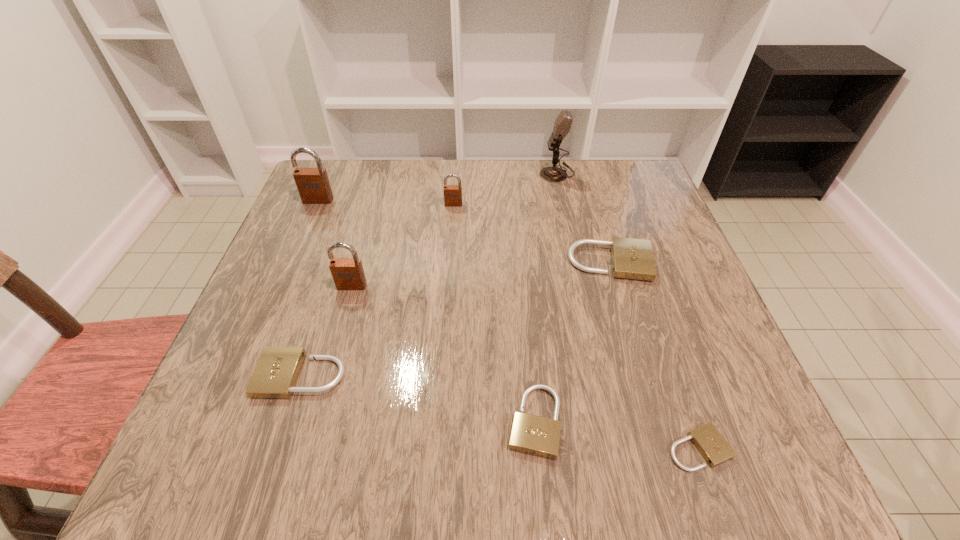
Where is `vacant space at the near edge`? The width and height of the screenshot is (960, 540). vacant space at the near edge is located at coordinates (348, 433).

The height and width of the screenshot is (540, 960). Identify the location of free space at the right edge of the desktop. (697, 350).

In the image, there is a desktop. Identify the location of vacant space at the far left corner. (340, 170).

Locate an element on the screen. This screenshot has width=960, height=540. vacant area at the far right corner is located at coordinates (650, 189).

You are a GUI agent. You are given a task and a screenshot of the screen. Output one action in this format:
    pyautogui.click(x=<x>, y=<y>)
    Task: Click on the free point between the fifth object from left to right and the rightmost brown padlock
    Image resolution: width=960 pixels, height=540 pixels.
    Given the screenshot: What is the action you would take?
    pyautogui.click(x=493, y=313)

Identify the location of free spot between the seventh tallest object and the farthest object. point(545,297).

You are a GUI agent. You are given a task and a screenshot of the screen. Output one action in this format:
    pyautogui.click(x=<x>, y=<y>)
    Task: Click on the vacant area that lies between the biggest brown padlock and the farthest object
    
    Given the screenshot: What is the action you would take?
    pyautogui.click(x=438, y=186)

Where is `vacant area that lies between the biggest brown padlock and the fifth object from left to right`? This screenshot has width=960, height=540. vacant area that lies between the biggest brown padlock and the fifth object from left to right is located at coordinates (426, 310).

Identify the location of free space that is in between the fifth padlock from left to right and the rightmost brown padlock. (493, 313).

This screenshot has height=540, width=960. Identify the location of unoccupied position between the rightmost brown padlock and the smallest beige padlock. (576, 326).